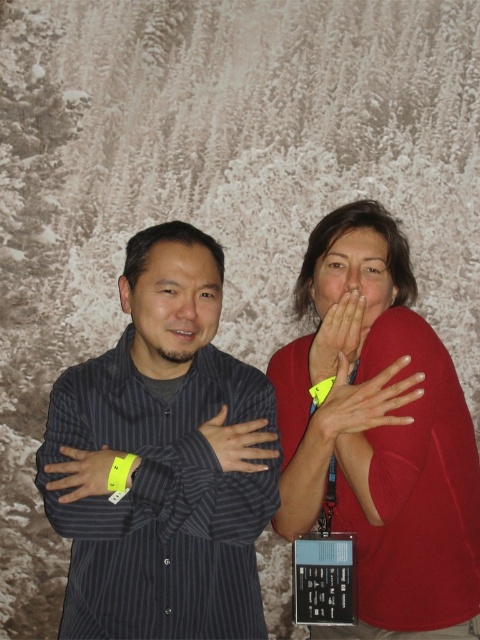
Does point (394, 474) come farther from viewer compared to point (354, 230)?

No, it is not.

Is matte red sweater at right smaller than matte skin face at center?

Actually, matte red sweater at right might be larger than matte skin face at center.

Is point (383, 307) closer to viewer compared to point (335, 266)?

Yes.

The width and height of the screenshot is (480, 640). In order to click on matte red sweater at right in this screenshot , I will do `click(381, 435)`.

Does dark gray striped shirt at center appear over yellow fabric wristband at left?

Yes.

Can you confirm if dark gray striped shirt at center is bigger than yellow fabric wristband at left?

Yes.

Find the location of a particular element. The height and width of the screenshot is (640, 480). dark gray striped shirt at center is located at coordinates (166, 458).

Is matte red sweater at right further to camera compared to yellow fabric wristband at center?

That is True.

Does point (363, 422) come farther from viewer compared to point (363, 422)?

That is False.

Identify the location of matte red sweater at right. This screenshot has height=640, width=480. (381, 435).

Where is `matte red sweater at right`? This screenshot has width=480, height=640. matte red sweater at right is located at coordinates (381, 435).